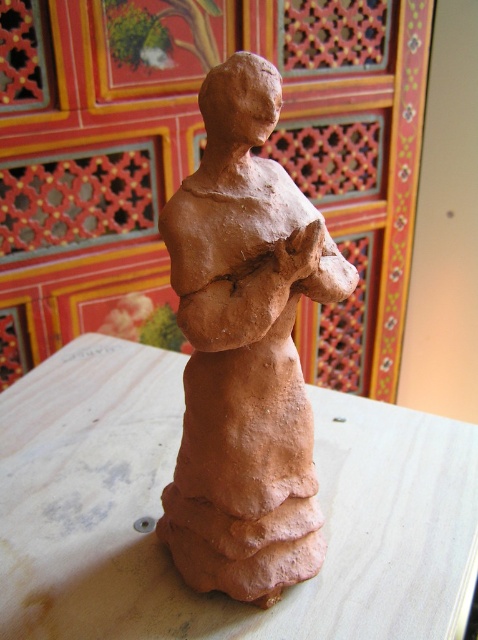
Question: In this image, where is matte wood table at center located relative to matte clay figure at center?

Choices:
 (A) below
 (B) above

Answer: (A)

Question: Does matte wood table at center appear on the left side of matte clay figure at center?

Choices:
 (A) yes
 (B) no

Answer: (A)

Question: Is matte wood table at center to the left of matte clay figure at center from the viewer's perspective?

Choices:
 (A) no
 (B) yes

Answer: (B)

Question: Which point appears closest to the camera in this image?

Choices:
 (A) (144, 458)
 (B) (249, 468)

Answer: (B)